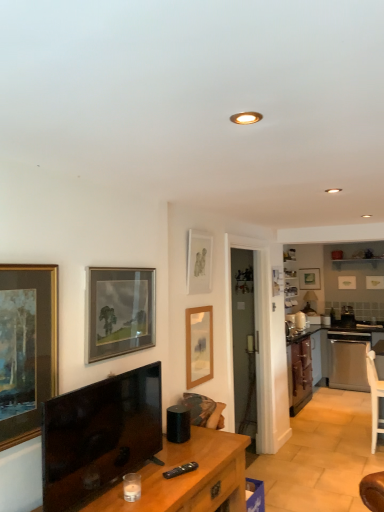
Question: Does point (1, 409) appear closer or farther from the camera than point (193, 372)?

Choices:
 (A) farther
 (B) closer

Answer: (B)

Question: Is wooden picture frame at left, which ranks as the 7th picture frame in right-to-left order, wider or thinner than wooden picture frame at center, marked as the third picture frame in a left-to-right arrangement?

Choices:
 (A) wide
 (B) thin

Answer: (B)

Question: Which object is the farthest from the matte white picture frame at upper center, the 4th picture frame positioned from the front?

Choices:
 (A) black glossy television at lower left
 (B) matte gold picture frame at upper right, positioned as the second picture frame in right-to-left order
 (C) white wooden chair at lower right
 (D) white glossy toaster at upper right, the 2th appliance in the front-to-back sequence
 (E) matte gold picture frame at upper right, placed as the 7th picture frame when sorted from left to right

Answer: (E)

Question: Which object is the closest to the matte wooden picture frame at upper right, the 7th picture frame in the front-to-back sequence?

Choices:
 (A) white wooden chair at lower right
 (B) black glossy television at lower left
 (C) satin silver dishwasher at lower right
 (D) matte glass picture frame at upper left, marked as the second picture frame in a front-to-back arrangement
 (E) matte gold picture frame at upper right, positioned as the 6th picture frame in front-to-back order

Answer: (E)